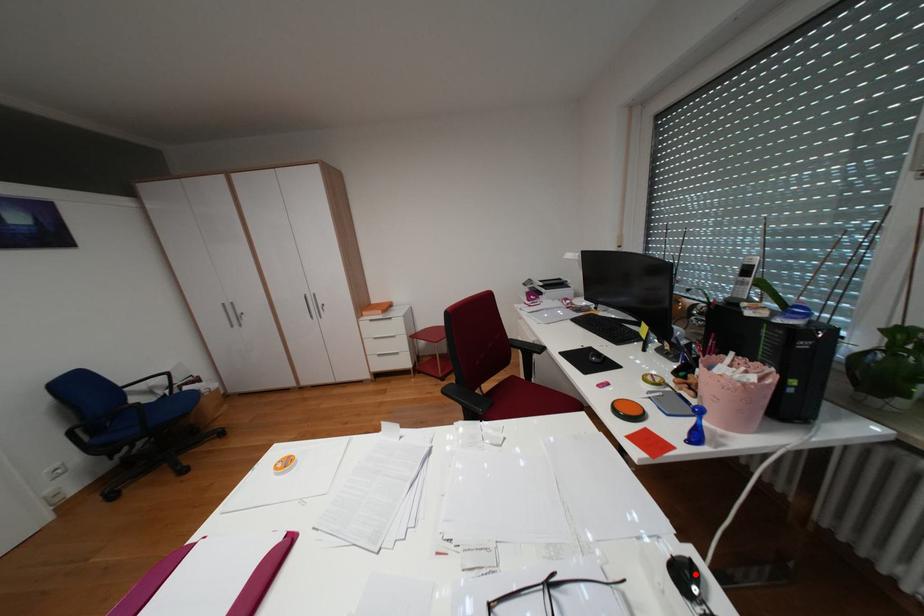
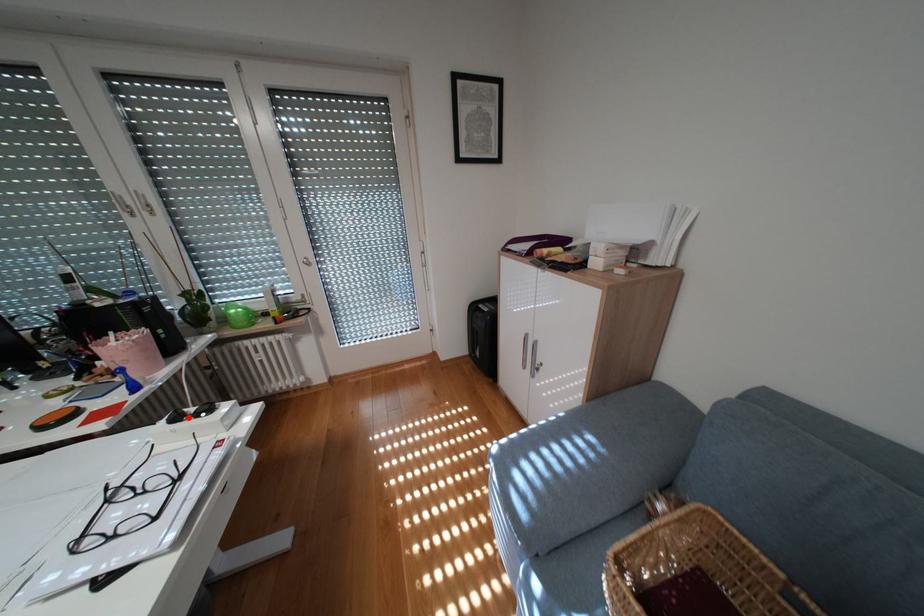
I am providing you with two images of the same scene from different viewpoints. A red point is marked on the first image and another point is marked on the second image. Is the red point in image1 aligned with the point shown in image2?

Yes